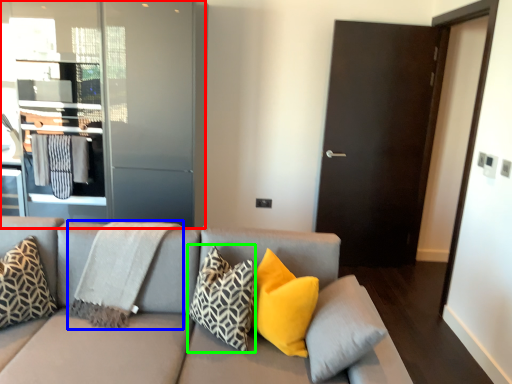
Question: Based on their relative distances, which object is nearer to elevator (highlighted by a red box)? Choose from blanket (highlighted by a blue box) and pillow (highlighted by a green box).

Choices:
 (A) blanket
 (B) pillow

Answer: (A)